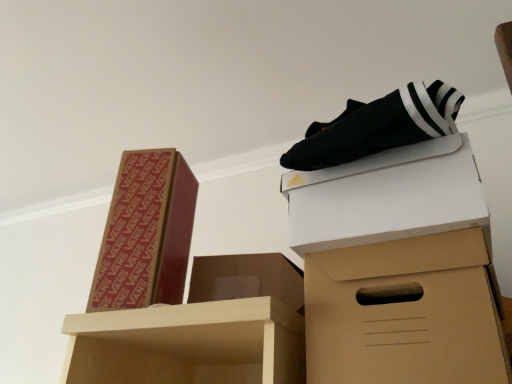
Question: Is white cardboard box at upper right, the first box positioned from the right, inside or outside of brown cardboard box at lower right?

Choices:
 (A) inside
 (B) outside

Answer: (B)

Question: From a real-world perspective, is white cardboard box at upper right, the first box positioned from the right, positioned above or below brown cardboard box at lower right?

Choices:
 (A) below
 (B) above

Answer: (B)

Question: Which object is positioned farthest from the brown cardboard box at upper left, arranged as the 3th box when viewed from the right?

Choices:
 (A) brown cardboard box at center, marked as the 2th box in a left-to-right arrangement
 (B) brown cardboard box at lower right
 (C) white cardboard box at upper right, the first box positioned from the right

Answer: (B)

Question: Estimate the real-world distances between objects in this image. Which object is farther from the brown cardboard box at center, the second box viewed from the right?

Choices:
 (A) brown cardboard box at lower right
 (B) brown cardboard box at upper left, the first box positioned from the left
 (C) white cardboard box at upper right, which ranks as the third box in left-to-right order

Answer: (C)